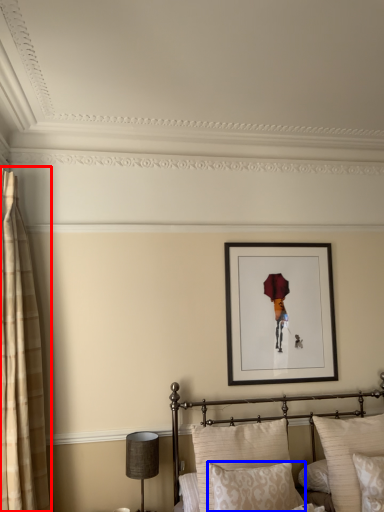
Question: Among these objects, which one is farthest to the camera, curtain (highlighted by a red box) or pillow (highlighted by a blue box)?

Choices:
 (A) curtain
 (B) pillow

Answer: (A)